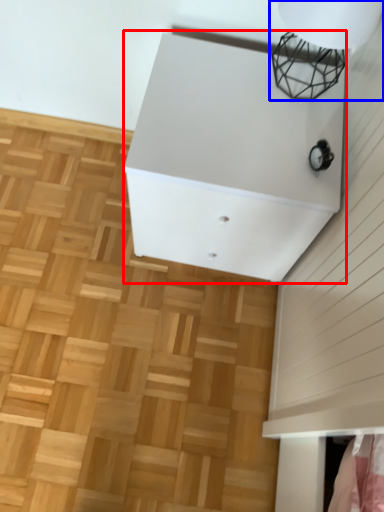
Question: Among these objects, which one is farthest to the camera, furniture (highlighted by a red box) or lamp (highlighted by a blue box)?

Choices:
 (A) furniture
 (B) lamp

Answer: (A)